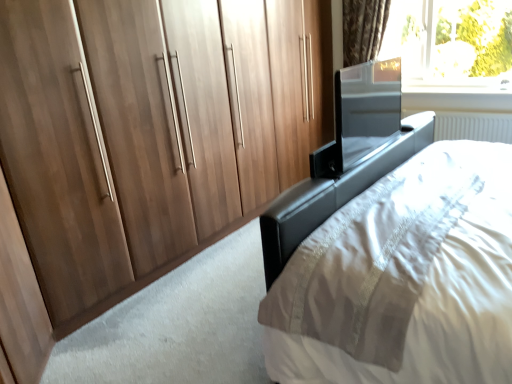
Question: From a real-world perspective, is black leather bed at center physically below walnut wood wardrobe at left?

Choices:
 (A) yes
 (B) no

Answer: (A)

Question: Considering the relative sizes of black leather bed at center and walnut wood wardrobe at left in the image provided, is black leather bed at center shorter than walnut wood wardrobe at left?

Choices:
 (A) no
 (B) yes

Answer: (B)

Question: Is there a large distance between black leather bed at center and walnut wood wardrobe at left?

Choices:
 (A) yes
 (B) no

Answer: (A)

Question: Does black leather bed at center have a lesser width compared to walnut wood wardrobe at left?

Choices:
 (A) no
 (B) yes

Answer: (B)

Question: Is black leather bed at center smaller than walnut wood wardrobe at left?

Choices:
 (A) no
 (B) yes

Answer: (B)

Question: In terms of width, does black leather bed at center look wider or thinner when compared to walnut wood wardrobe at left?

Choices:
 (A) wide
 (B) thin

Answer: (B)

Question: Considering the positions of point (497, 311) and point (243, 124), is point (497, 311) closer or farther from the camera than point (243, 124)?

Choices:
 (A) farther
 (B) closer

Answer: (B)

Question: From the image's perspective, is black leather bed at center positioned above or below walnut wood wardrobe at left?

Choices:
 (A) below
 (B) above

Answer: (A)

Question: In the image, is black leather bed at center positioned in front of or behind walnut wood wardrobe at left?

Choices:
 (A) front
 (B) behind

Answer: (A)

Question: In the image, is walnut wood wardrobe at left positioned in front of or behind transparent glass window at upper right?

Choices:
 (A) behind
 (B) front

Answer: (B)

Question: From the image's perspective, is walnut wood wardrobe at left positioned above or below transparent glass window at upper right?

Choices:
 (A) below
 (B) above

Answer: (A)

Question: Is point (137, 34) closer or farther from the camera than point (403, 59)?

Choices:
 (A) closer
 (B) farther

Answer: (A)

Question: In terms of height, does walnut wood wardrobe at left look taller or shorter compared to transparent glass window at upper right?

Choices:
 (A) short
 (B) tall

Answer: (B)

Question: Relative to black leather bed at center, is transparent glass window at upper right in front or behind?

Choices:
 (A) behind
 (B) front

Answer: (A)

Question: Considering the positions of transparent glass window at upper right and black leather bed at center in the image, is transparent glass window at upper right wider or thinner than black leather bed at center?

Choices:
 (A) wide
 (B) thin

Answer: (B)